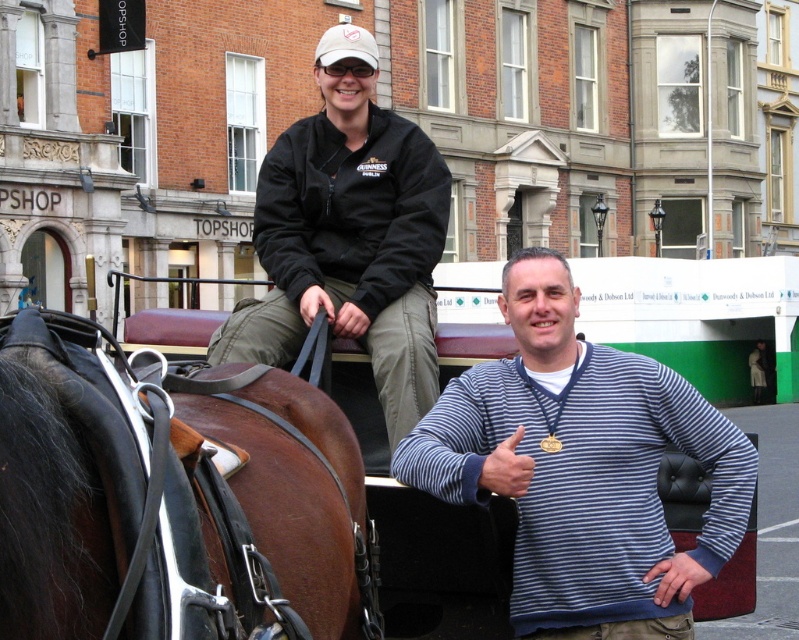
Question: Considering the real-world distances, which object is farthest from the brown leather saddle at upper left?

Choices:
 (A) blue striped sweater at center
 (B) striped sweater at center

Answer: (B)

Question: Estimate the real-world distances between objects in this image. Which object is closer to the striped sweater at center?

Choices:
 (A) blue striped sweater at center
 (B) brown leather saddle at upper left

Answer: (A)

Question: Which of the following is the closest to the observer?

Choices:
 (A) (422, 301)
 (B) (193, 504)
 (C) (575, 520)

Answer: (B)

Question: Is blue striped sweater at center in front of striped sweater at center?

Choices:
 (A) no
 (B) yes

Answer: (B)

Question: Is brown leather saddle at upper left positioned before blue striped sweater at center?

Choices:
 (A) yes
 (B) no

Answer: (A)

Question: Does brown leather saddle at upper left have a larger size compared to striped sweater at center?

Choices:
 (A) no
 (B) yes

Answer: (A)